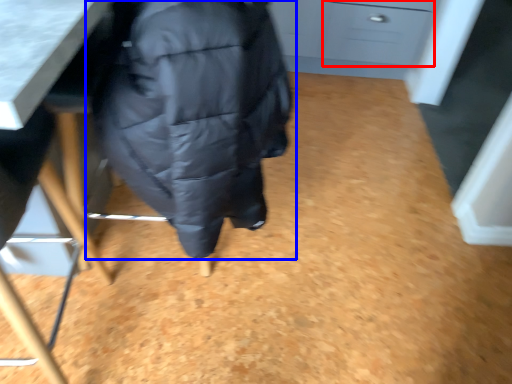
Question: Which object is further to the camera taking this photo, drawer (highlighted by a red box) or jacket (highlighted by a blue box)?

Choices:
 (A) drawer
 (B) jacket

Answer: (A)